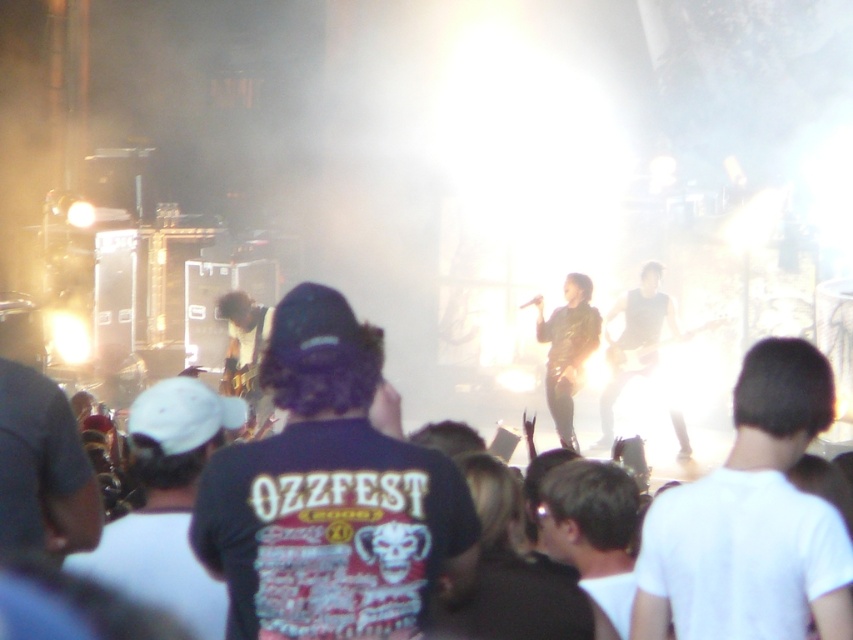
Question: Which object is farther from the camera taking this photo?

Choices:
 (A) dark blue t-shirt at center
 (B) white matte shirt at center

Answer: (B)

Question: Which of the following is the farthest from the observer?

Choices:
 (A) shiny black guitar at center
 (B) white cotton cap at lower left
 (C) white matte shirt at center

Answer: (A)

Question: Is white cotton cap at lower left wider than shiny black guitar at center?

Choices:
 (A) yes
 (B) no

Answer: (B)

Question: Which object is farther from the camera taking this photo?

Choices:
 (A) dark brown hair at center
 (B) dark blue t-shirt at center

Answer: (A)

Question: Is dark blue t-shirt at center thinner than white matte shirt at center?

Choices:
 (A) no
 (B) yes

Answer: (A)

Question: Can you confirm if white matte shirt at center is positioned above shiny black guitar at center?

Choices:
 (A) yes
 (B) no

Answer: (B)